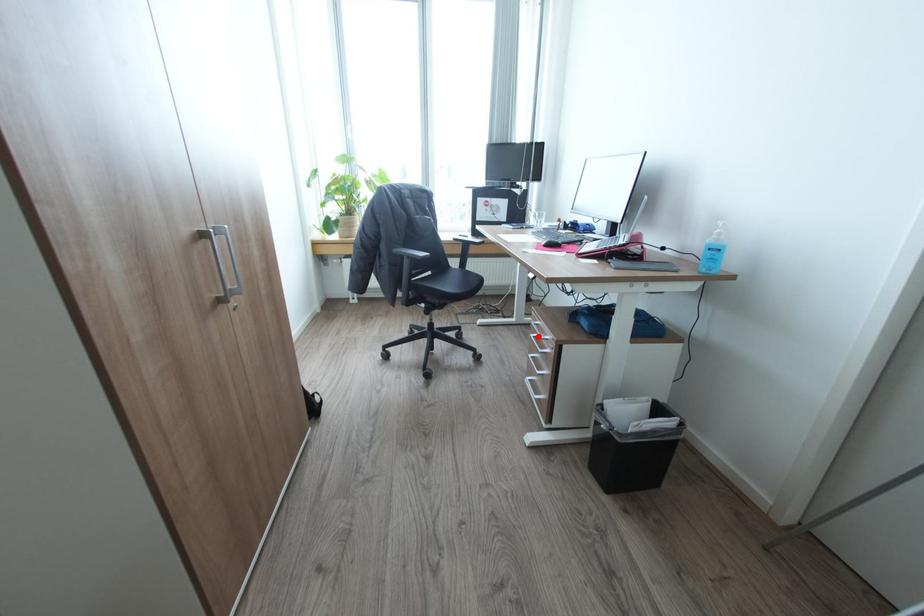
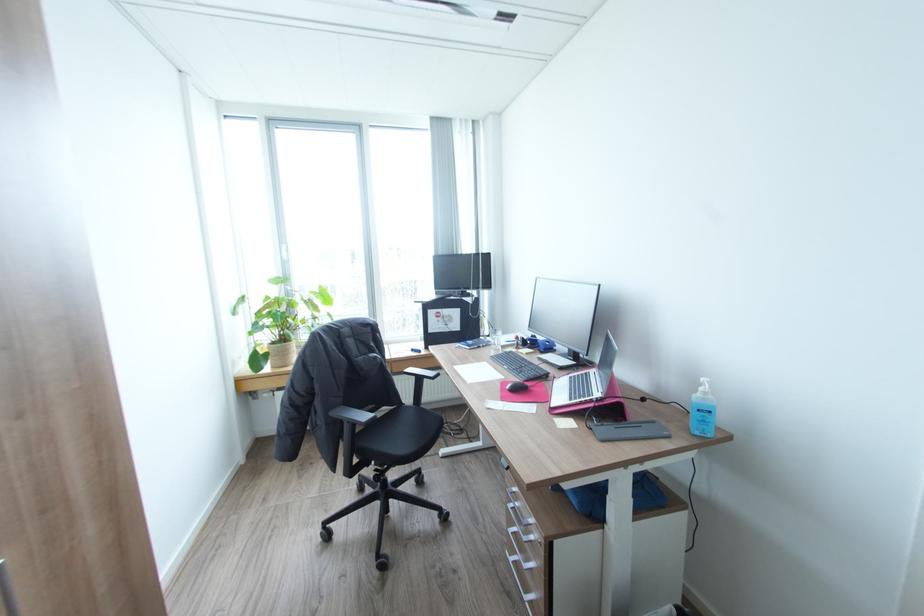
The point at the highlighted location is marked in the first image. Where is the corresponding point in the second image?

(517, 508)